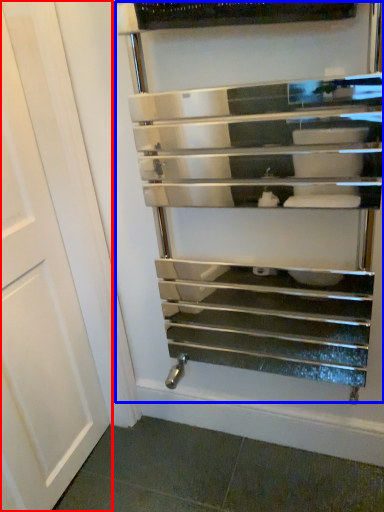
Question: Which of the following is the closest to the observer, door (highlighted by a red box) or shelf (highlighted by a blue box)?

Choices:
 (A) door
 (B) shelf

Answer: (A)